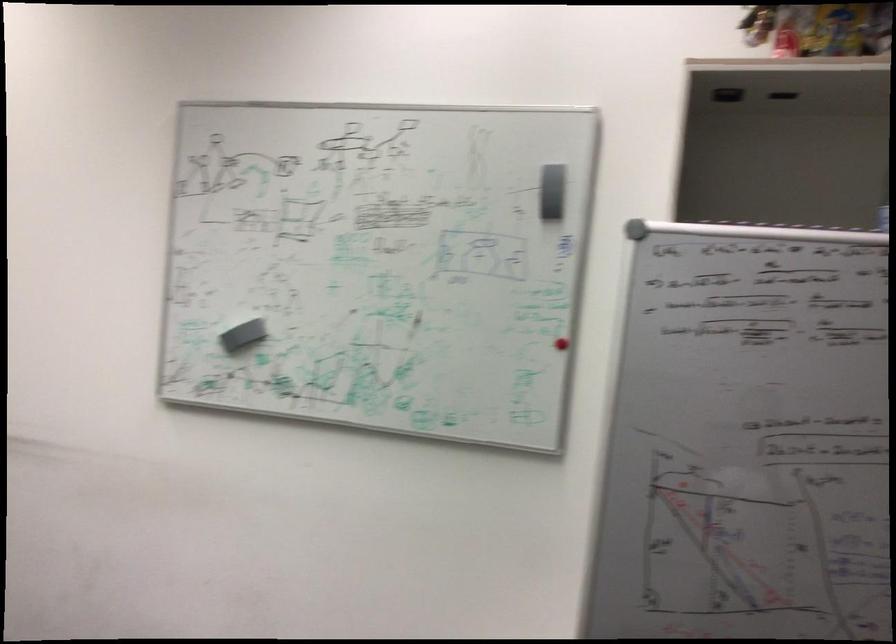
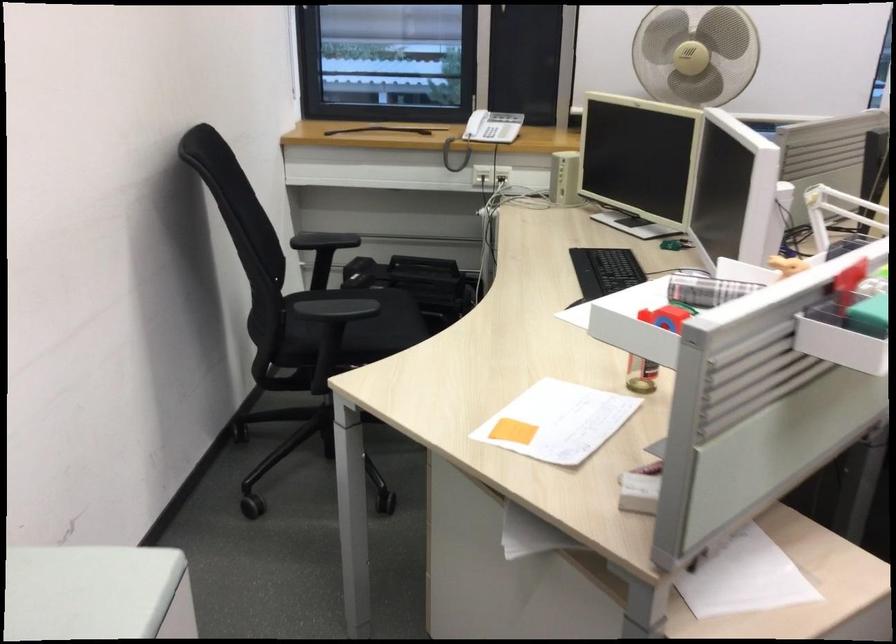
Based on the continuous images, in which direction is the camera rotating?

The rotation direction of the camera is left-down.